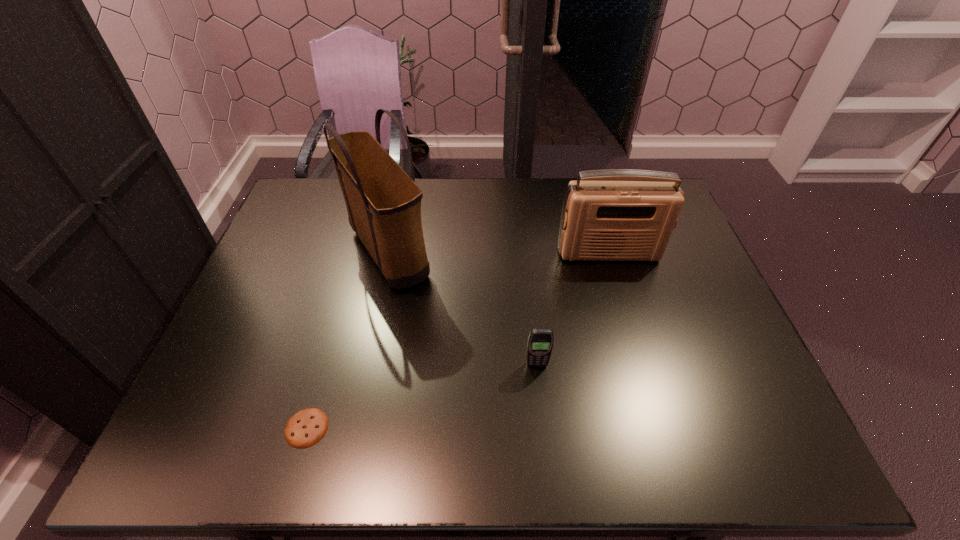
At what (x,y) coordinates should I click in order to perform the action: click on blank space located on the right of the cookie. Please return your answer as a coordinate pair (x, y). Looking at the image, I should click on (454, 428).

Locate an element on the screen. The width and height of the screenshot is (960, 540). object located in the far edge section of the desktop is located at coordinates (383, 203).

Identify the location of object that is at the near edge. The image size is (960, 540). (305, 428).

Locate an element on the screen. This screenshot has width=960, height=540. object positioned at the right edge is located at coordinates (618, 214).

At what (x,y) coordinates should I click in order to perform the action: click on free location at the far edge of the desktop. Please return your answer as a coordinate pair (x, y). This screenshot has height=540, width=960. Looking at the image, I should click on (423, 204).

The image size is (960, 540). In the image, there is a desktop. What are the coordinates of `vacant space at the near edge` in the screenshot? It's located at (540, 449).

What are the coordinates of `free region at the left edge` in the screenshot? It's located at (256, 308).

The height and width of the screenshot is (540, 960). What are the coordinates of `vacant area at the right edge of the desktop` in the screenshot? It's located at (704, 348).

Locate an element on the screen. free space at the far left corner of the desktop is located at coordinates (307, 198).

Locate an element on the screen. The image size is (960, 540). vacant space that is in between the cellular telephone and the shortest object is located at coordinates (421, 396).